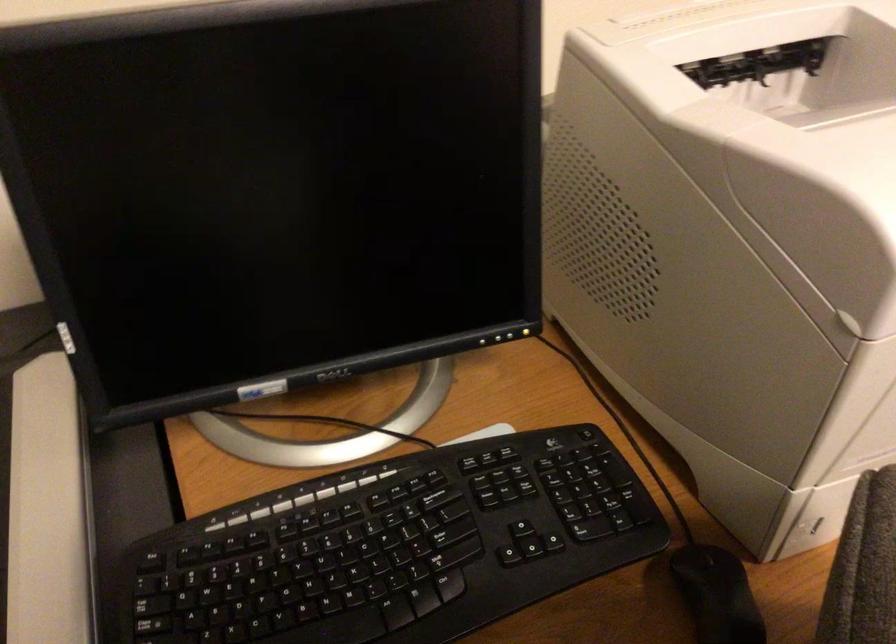
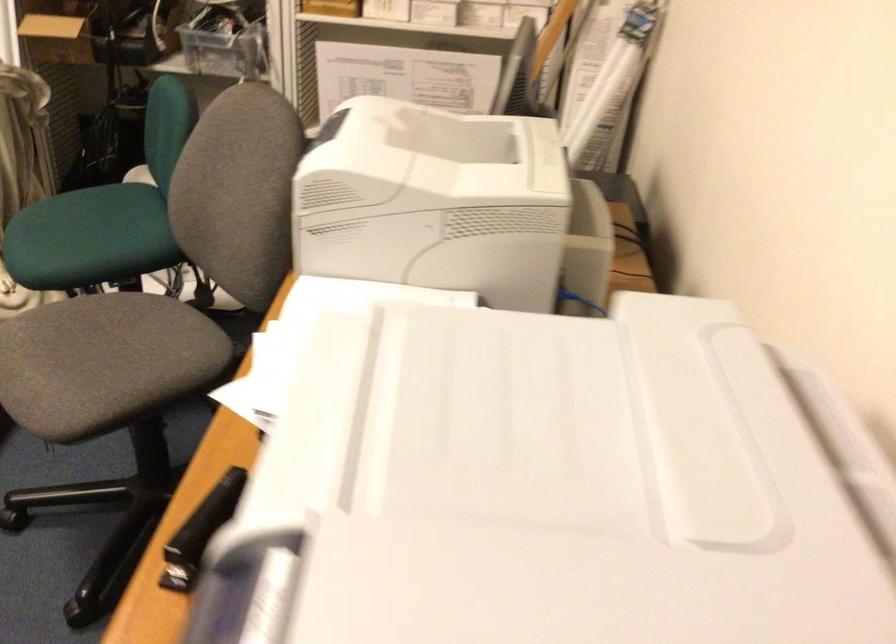
Question: I am providing you with two images of the same scene from different viewpoints. After the viewpoint changes to image2, which objects are now occluded?

Choices:
 (A) small metal pot
 (B) gray chair sitting surface
 (C) printer lid handle
 (D) black computer mouse

Answer: (D)